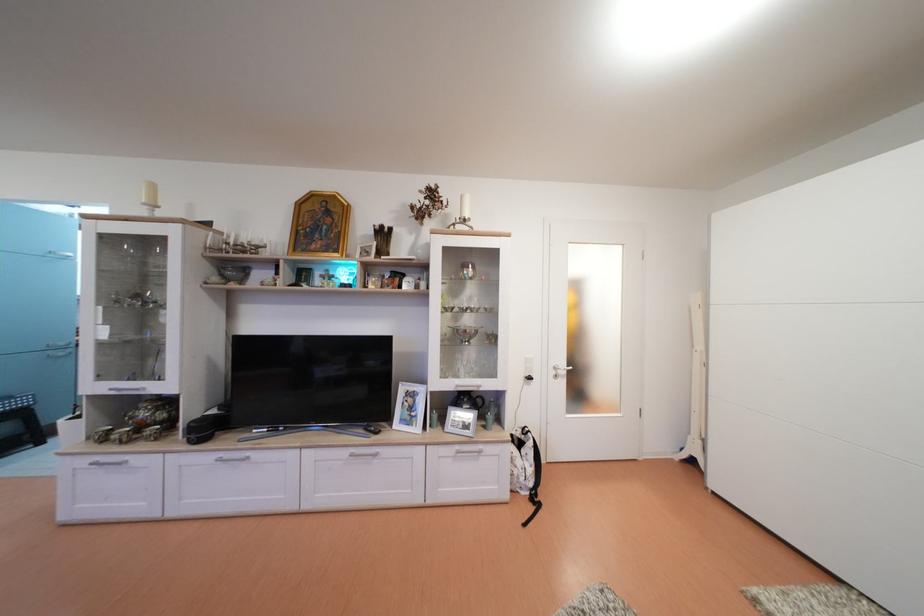
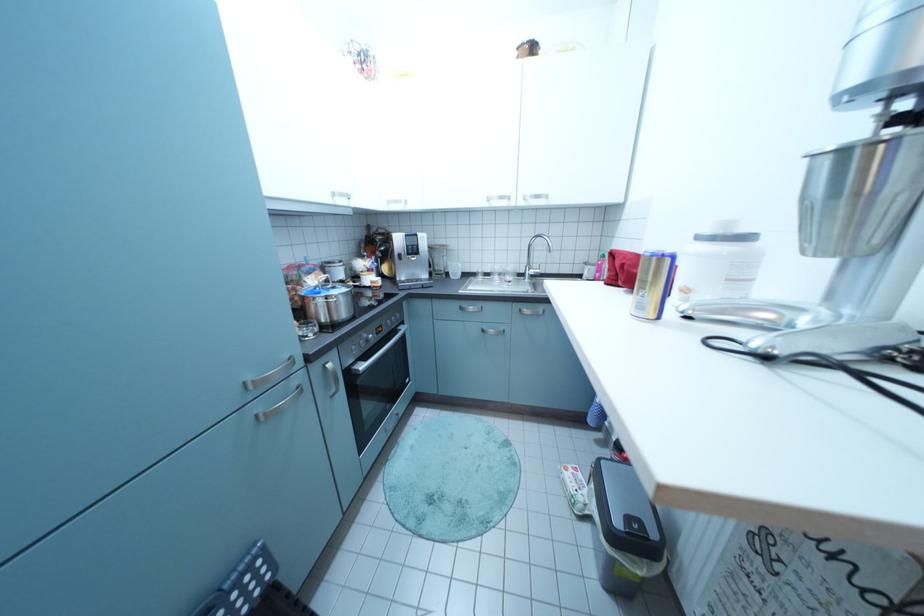
Which direction would the cameraman need to move to produce the second image?

The movement direction of the cameraman is left, forward.